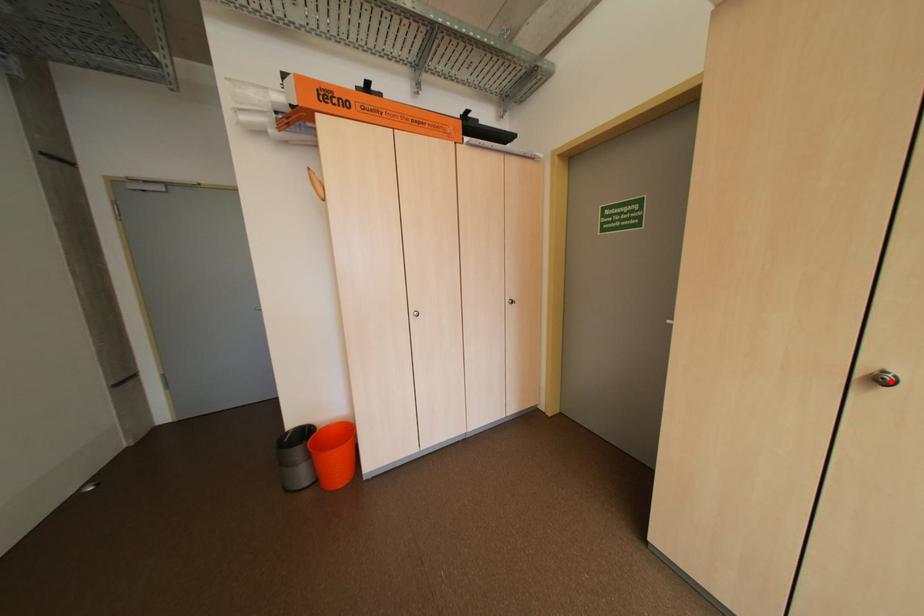
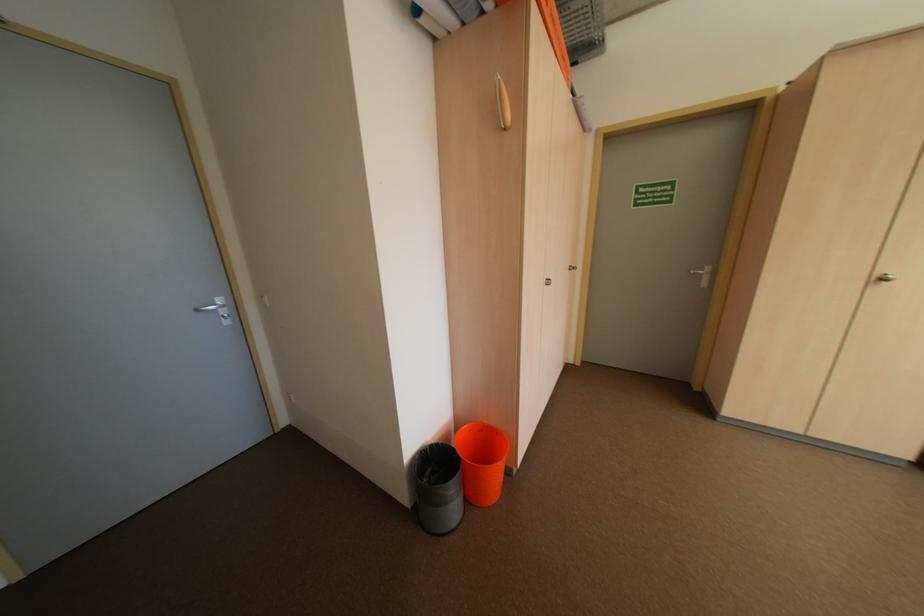
Locate, in the second image, the point that corresponds to the highlighted location in the first image.

(893, 281)